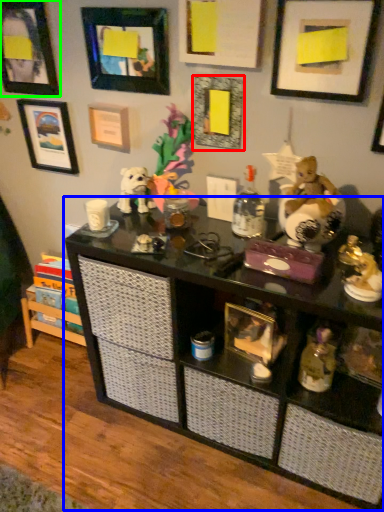
Question: Considering the real-world distances, which object is closest to picture frame (highlighted by a red box)? shelf (highlighted by a blue box) or picture frame (highlighted by a green box).

Choices:
 (A) shelf
 (B) picture frame

Answer: (A)